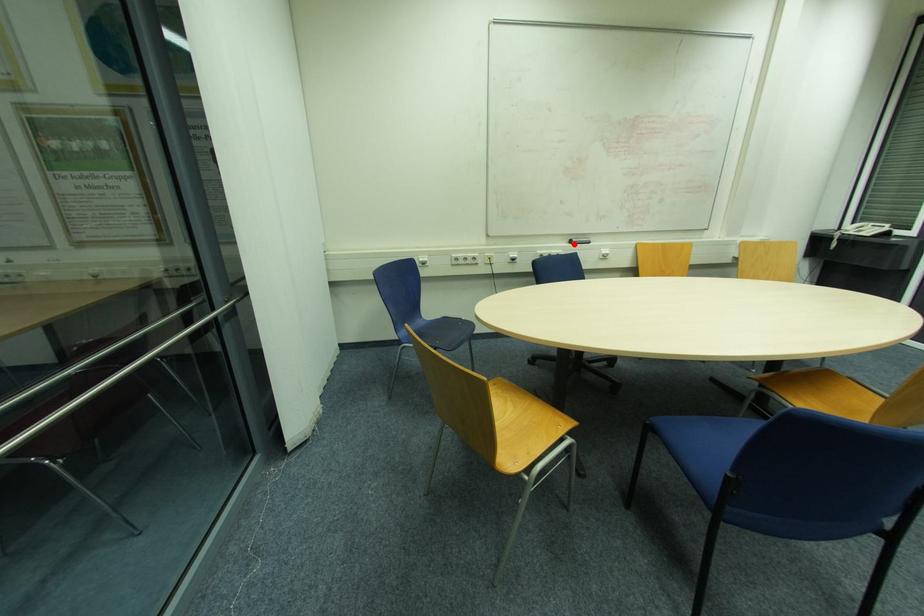
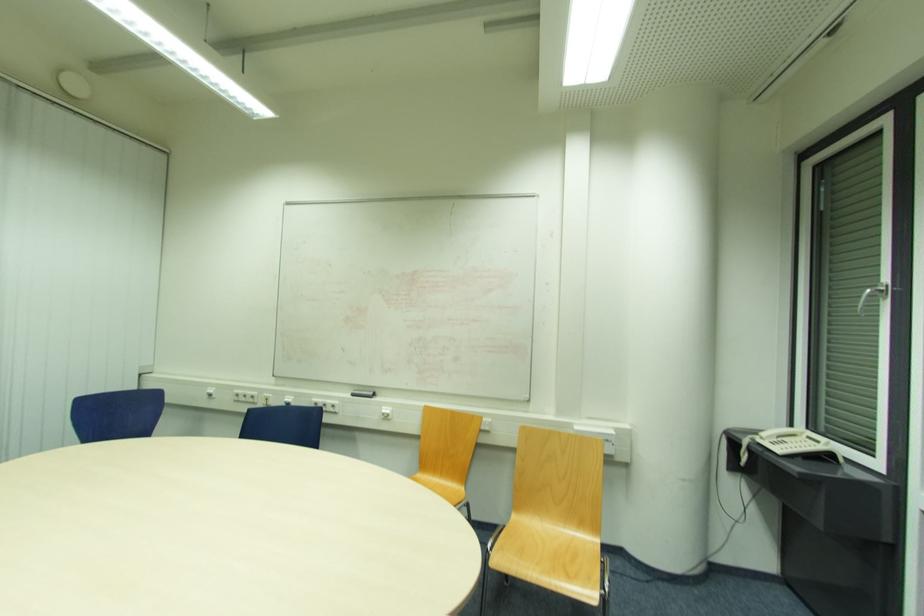
Where in the second image is the point corresponding to the highlighted location from the first image?

(355, 395)